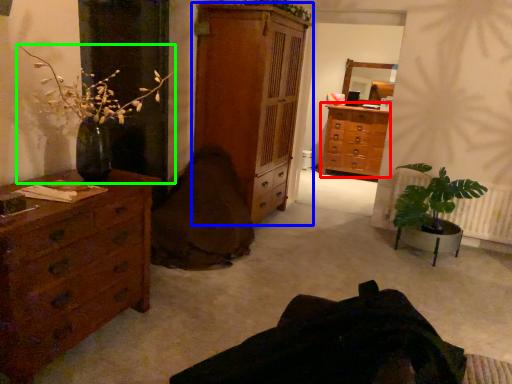
Question: Considering the real-world distances, which object is farthest from chest of drawers (highlighted by a red box)? chest of drawers (highlighted by a blue box) or houseplant (highlighted by a green box)?

Choices:
 (A) chest of drawers
 (B) houseplant

Answer: (B)